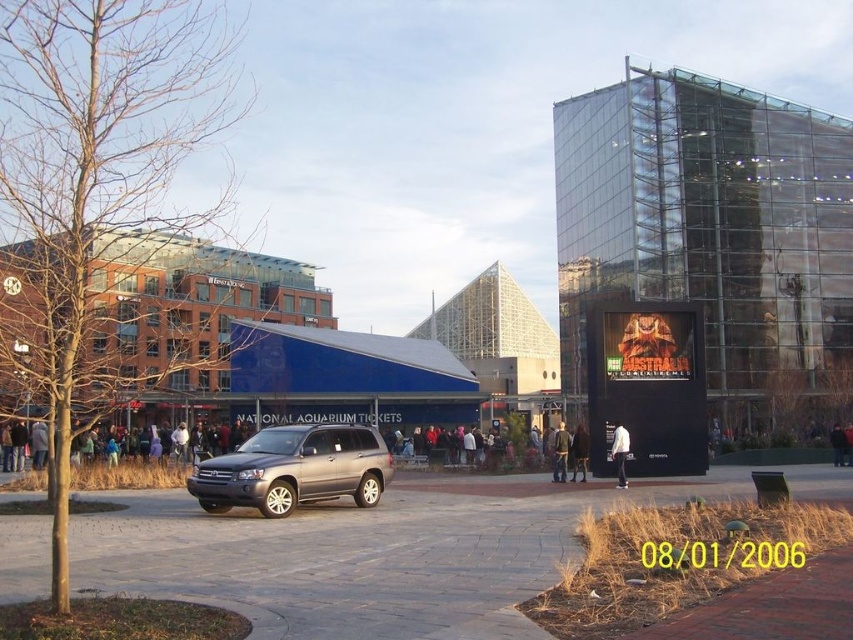
Question: Which object is closer to the camera taking this photo?

Choices:
 (A) glassy modern building at center
 (B) transparent glass building at upper right
 (C) white matte jacket at center

Answer: (C)

Question: Does white matte jacket at center come behind dark gray jacket at center?

Choices:
 (A) yes
 (B) no

Answer: (B)

Question: Which point is farther to the camera?

Choices:
 (A) dark gray jacket at center
 (B) dark blue jacket at center
 (C) white matte jacket at center

Answer: (B)

Question: Is glassy modern building at center bigger than dark blue jacket at center?

Choices:
 (A) no
 (B) yes

Answer: (B)

Question: Is white matte jacket at center positioned at the back of denim jacket at center?

Choices:
 (A) no
 (B) yes

Answer: (A)

Question: Considering the real-world distances, which object is closest to the transparent glass building at upper right?

Choices:
 (A) white matte jacket at center
 (B) blue glass building at center

Answer: (B)